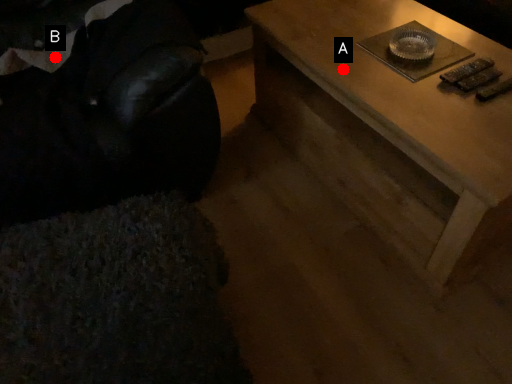
Question: Two points are circled on the image, labeled by A and B beside each circle. Which point is closer to the camera?

Choices:
 (A) A is closer
 (B) B is closer

Answer: (A)